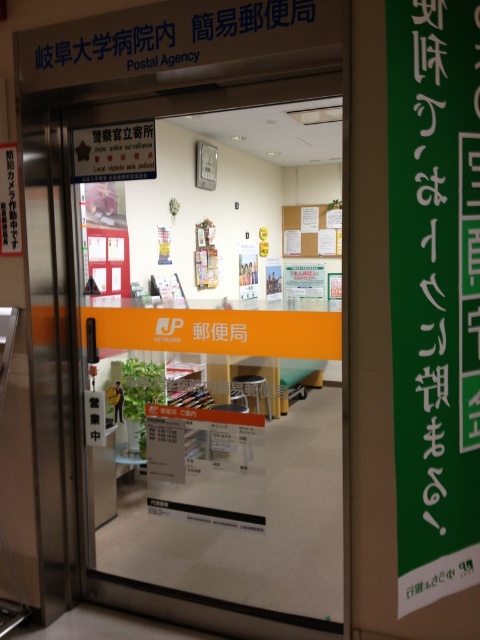
Does transparent glass door at center appear on the right side of green paper at center?

Yes, transparent glass door at center is to the right of green paper at center.

Between point (310, 304) and point (475, 292), which one is positioned in front?

Positioned in front is point (475, 292).

The image size is (480, 640). I want to click on transparent glass door at center, so click(x=223, y=358).